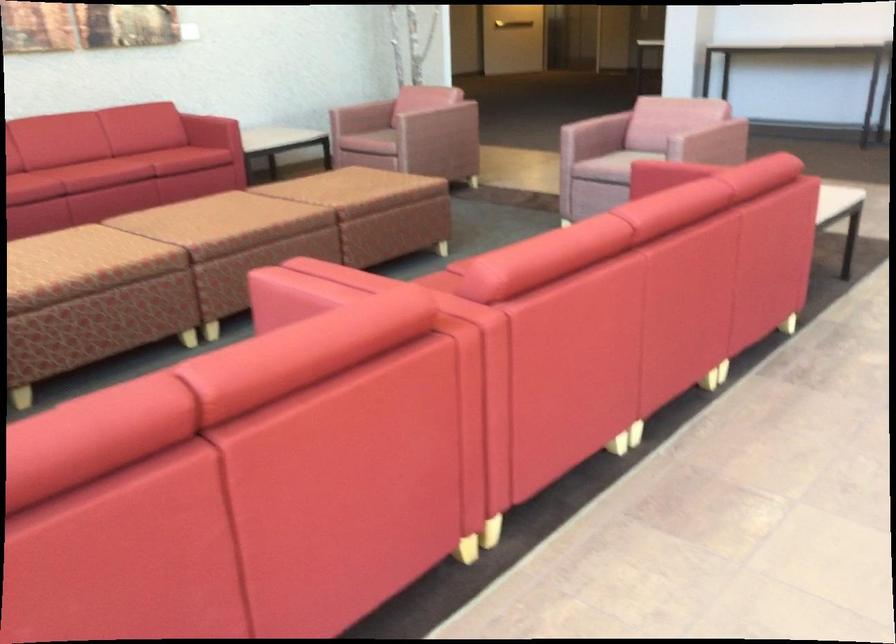
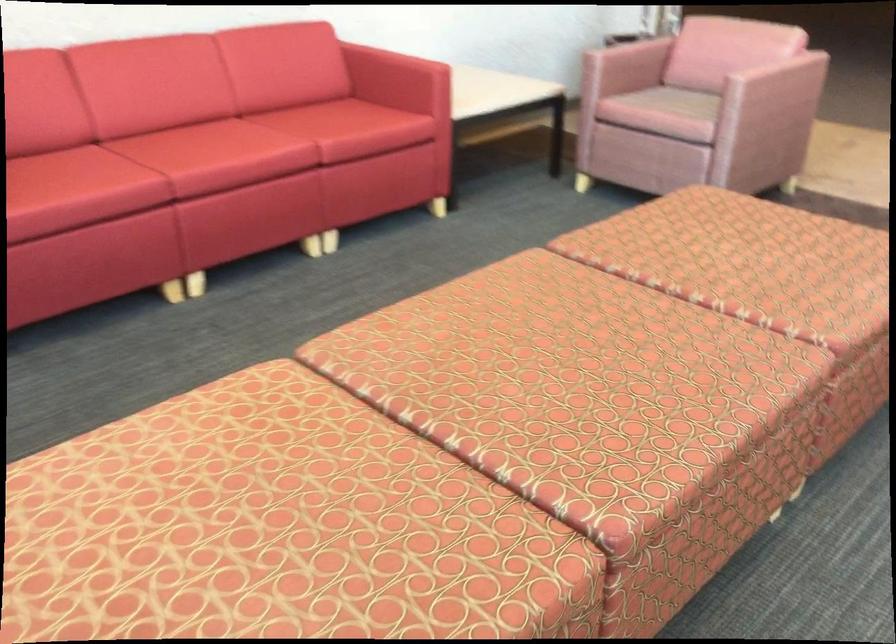
Locate, in the second image, the point that corresponds to (x=142, y=162) in the first image.

(309, 156)